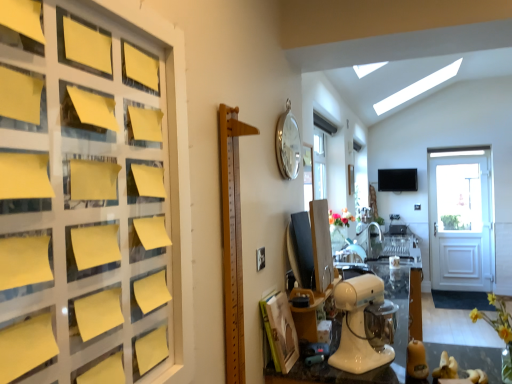
Question: In the image, is transparent glass table at lower right positioned in front of or behind wooden ruler at center?

Choices:
 (A) front
 (B) behind

Answer: (B)

Question: In terms of size, does transparent glass table at lower right appear bigger or smaller than wooden ruler at center?

Choices:
 (A) small
 (B) big

Answer: (A)

Question: Based on their relative distances, which object is nearer to the transparent glass table at lower right?

Choices:
 (A) yellow matte flower at lower right, the first flower viewed from the front
 (B) floral bouquet at center, marked as the 1th flower in a back-to-front arrangement
 (C) wooden ruler at center
 (D) white glossy stand mixer at center
 (E) silver metallic clock at upper center

Answer: (A)

Question: Which is nearer to the wooden ruler at center?

Choices:
 (A) transparent glass table at lower right
 (B) yellow rubber duck at lower right
 (C) silver metallic clock at upper center
 (D) yellow paper at left
 (E) floral bouquet at center, acting as the 2th flower starting from the front

Answer: (D)